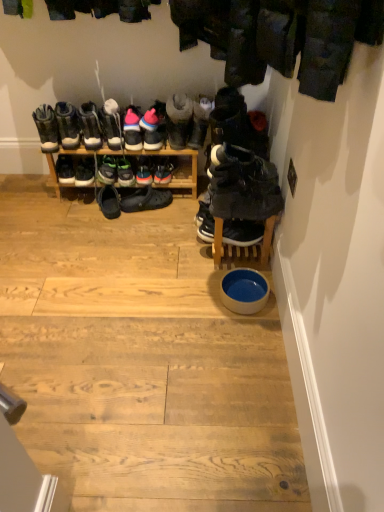
At what (x,y) coordinates should I click in order to perform the action: click on vacant area to the left of wooden shoe rack at center. Please return your answer as a coordinate pair (x, y). The height and width of the screenshot is (512, 384). Looking at the image, I should click on (37, 206).